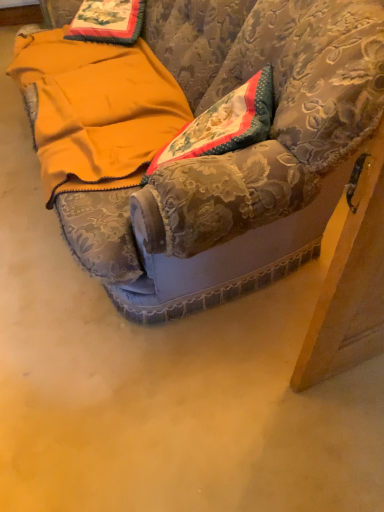
Question: In terms of width, does yellow fleece blanket at lower left look wider or thinner when compared to velvet couch at center?

Choices:
 (A) thin
 (B) wide

Answer: (A)

Question: Is yellow fleece blanket at lower left in front of or behind velvet couch at center in the image?

Choices:
 (A) front
 (B) behind

Answer: (B)

Question: Is yellow fleece blanket at lower left inside or outside of velvet couch at center?

Choices:
 (A) outside
 (B) inside

Answer: (B)

Question: Do you think velvet couch at center is within yellow fleece blanket at lower left, or outside of it?

Choices:
 (A) outside
 (B) inside

Answer: (A)

Question: From a real-world perspective, is velvet couch at center above or below yellow fleece blanket at lower left?

Choices:
 (A) above
 (B) below

Answer: (A)

Question: In terms of size, does velvet couch at center appear bigger or smaller than yellow fleece blanket at lower left?

Choices:
 (A) small
 (B) big

Answer: (B)

Question: Considering the positions of velvet couch at center and yellow fleece blanket at lower left in the image, is velvet couch at center taller or shorter than yellow fleece blanket at lower left?

Choices:
 (A) tall
 (B) short

Answer: (A)